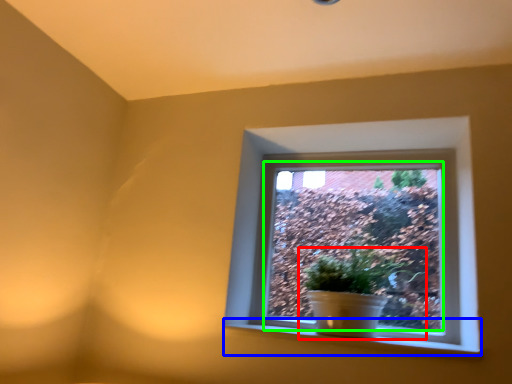
Question: Considering the real-world distances, which object is closest to houseplant (highlighted by a red box)? window sill (highlighted by a blue box) or window screen (highlighted by a green box).

Choices:
 (A) window sill
 (B) window screen

Answer: (B)